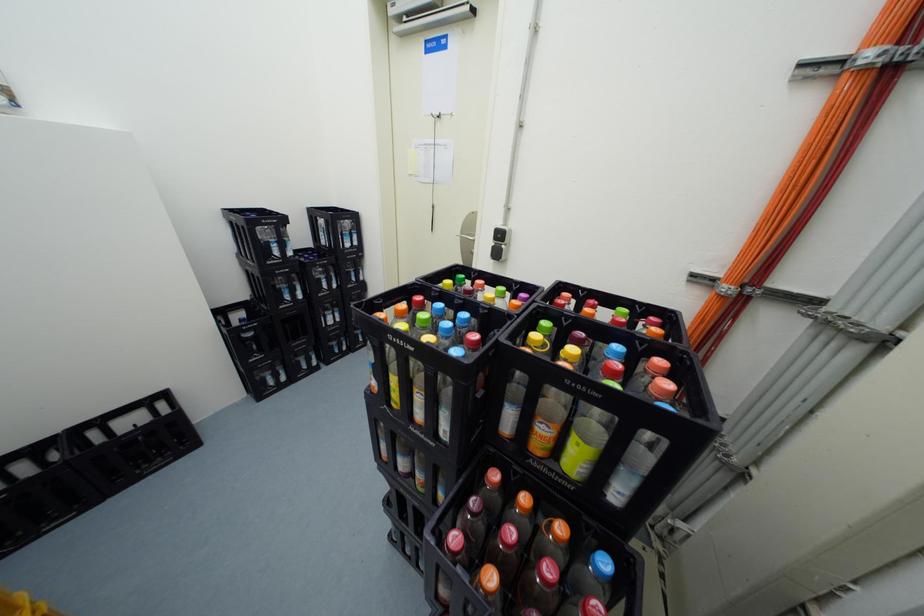
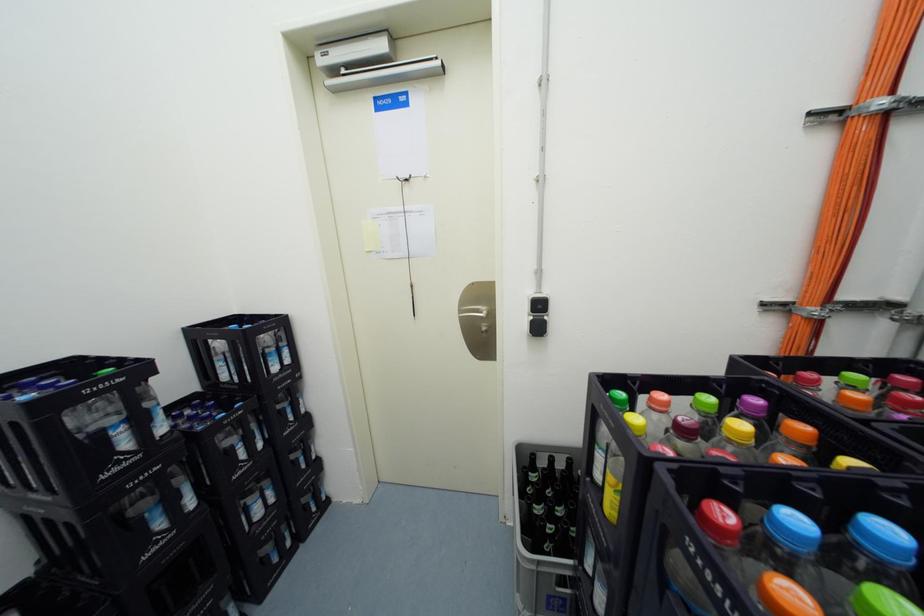
What movement of the cameraman would produce the second image?

The movement direction of the cameraman is left, forward.